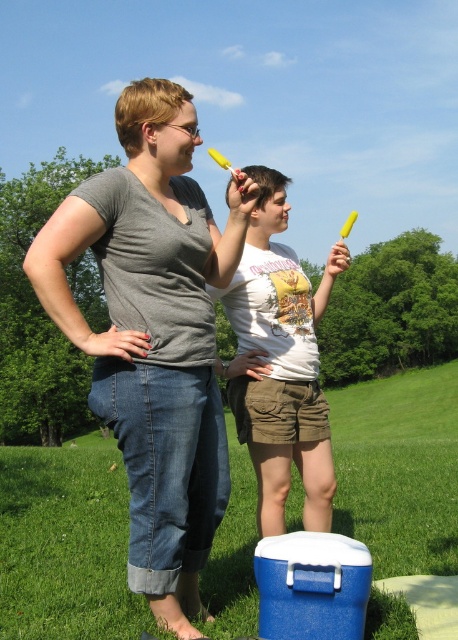
Question: Among these points, which one is nearest to the camera?

Choices:
 (A) (103, 561)
 (B) (260, 440)
 (C) (207, 481)

Answer: (C)

Question: Is matte gray shirt at center closer to the viewer compared to green grass at lower center?

Choices:
 (A) no
 (B) yes

Answer: (B)

Question: Estimate the real-world distances between objects in this image. Which object is closer to the white cotton t-shirt at center?

Choices:
 (A) matte gray shirt at center
 (B) green grass at lower center

Answer: (A)

Question: Does green grass at lower center appear under white cotton t-shirt at center?

Choices:
 (A) yes
 (B) no

Answer: (A)

Question: Which point is closer to the camera?

Choices:
 (A) (154, 388)
 (B) (257, 173)

Answer: (A)

Question: Does matte gray shirt at center lie in front of white cotton t-shirt at center?

Choices:
 (A) no
 (B) yes

Answer: (B)